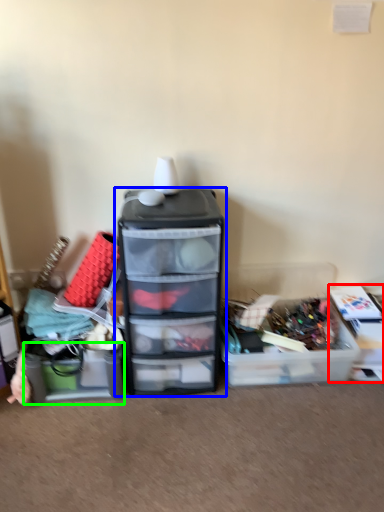
Question: Which object is positioned closest to storage box (highlighted by a red box)? Select from furniture (highlighted by a blue box) and storage box (highlighted by a green box).

Choices:
 (A) furniture
 (B) storage box

Answer: (A)